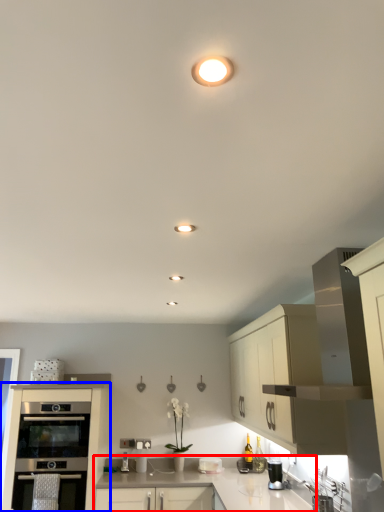
Question: Which object is closer to the camera taking this photo, countertop (highlighted by a red box) or cabinetry (highlighted by a blue box)?

Choices:
 (A) countertop
 (B) cabinetry

Answer: (B)